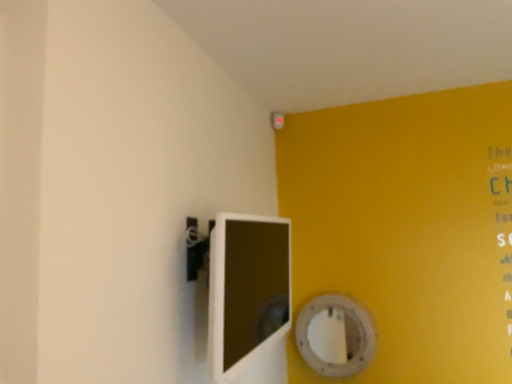
Describe the element at coordinates (335, 335) in the screenshot. I see `white glossy mirror at upper center` at that location.

This screenshot has height=384, width=512. What are the coordinates of `white glossy mirror at upper center` in the screenshot? It's located at (335, 335).

Where is `white glossy mirror at upper center`? white glossy mirror at upper center is located at coordinates coord(335,335).